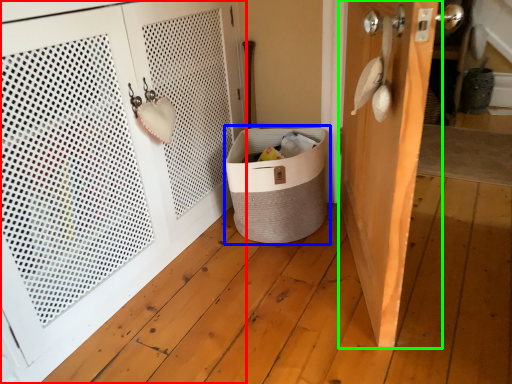
Question: Which is farther away from door (highlighted by a red box)? laundry basket (highlighted by a blue box) or door (highlighted by a green box)?

Choices:
 (A) laundry basket
 (B) door

Answer: (B)